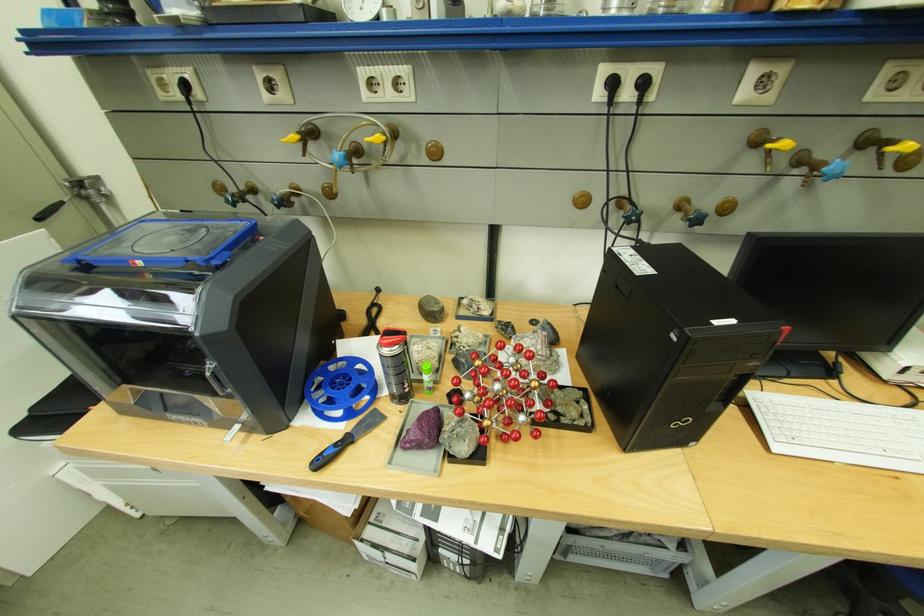
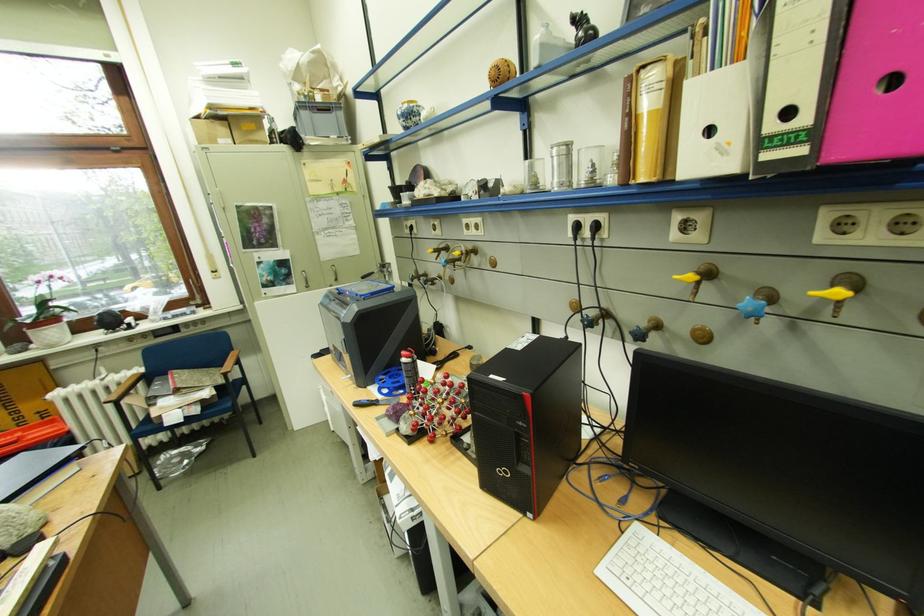
Find the pixel in the second image that matches point 332,463 in the first image.

(369, 406)